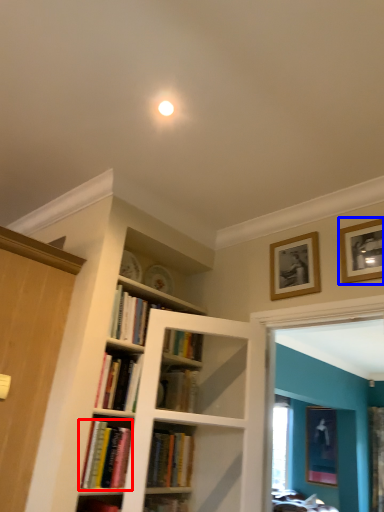
Question: Which object is further to the camera taking this photo, book (highlighted by a red box) or picture frame (highlighted by a blue box)?

Choices:
 (A) book
 (B) picture frame

Answer: (B)